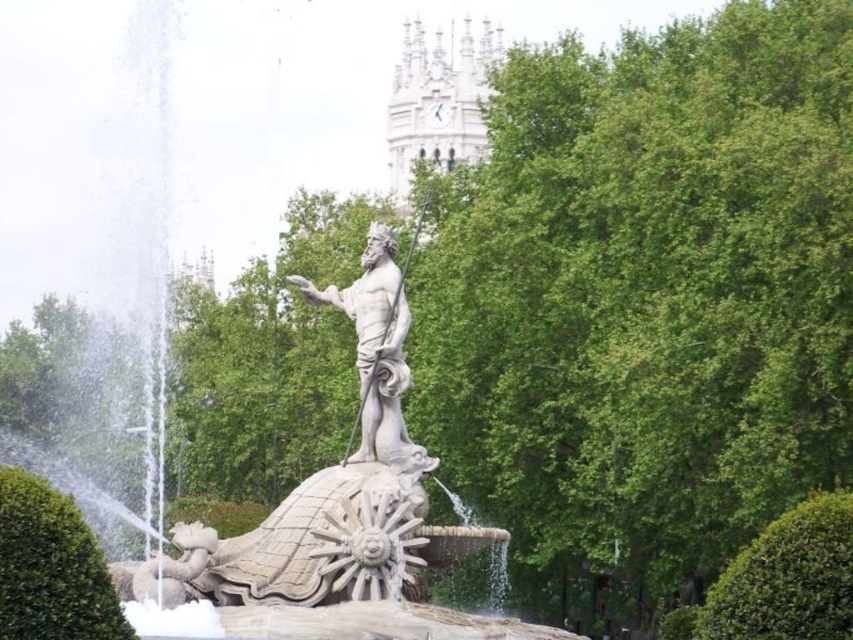
Question: Which object is the farthest from the green leafy hedge at lower right?

Choices:
 (A) white stone statue at center
 (B) green leafy hedge at left

Answer: (B)

Question: Which point is farther from the camera taking this photo?

Choices:
 (A) (834, 554)
 (B) (399, 109)
 (C) (83, 637)

Answer: (B)

Question: Which point appears farthest from the camera in this image?

Choices:
 (A) (372, 406)
 (B) (749, 634)

Answer: (A)

Question: Is the position of green leafy hedge at lower right more distant than that of white stone clock tower at upper center?

Choices:
 (A) yes
 (B) no

Answer: (B)

Question: Does green leafy hedge at lower right have a larger size compared to green leafy hedge at left?

Choices:
 (A) no
 (B) yes

Answer: (B)

Question: Does green leafy hedge at lower right appear on the left side of white stone clock tower at upper center?

Choices:
 (A) yes
 (B) no

Answer: (B)